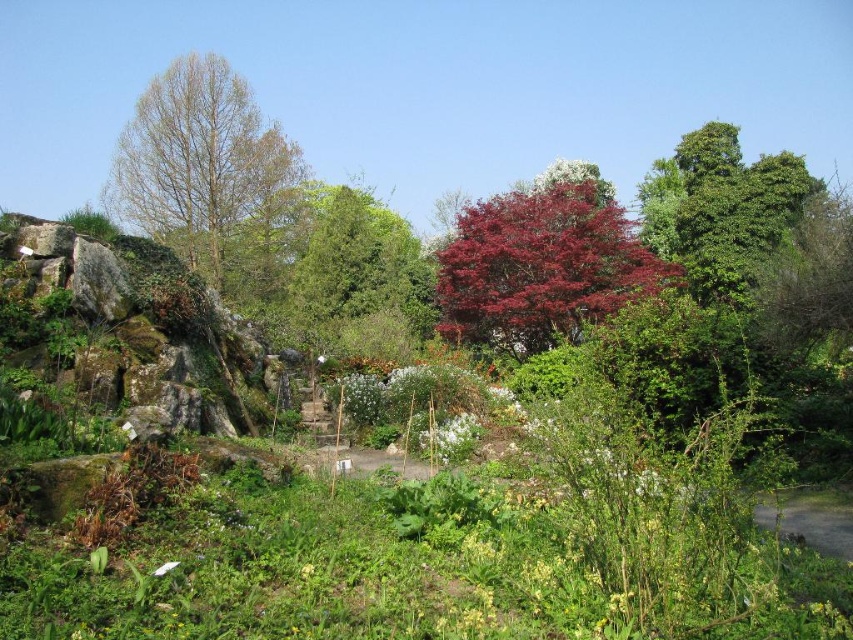
Based on the photo, you are a gardener who needs to water both the green mossy rock at left and the glossy red tree at center. The watering can you have can only hold enough water to reach 6 meters. Can you water both without refilling?

The green mossy rock at left is 6.57 meters away from glossy red tree at center. Since the distance between them is more than 6 meters, you cannot water both without refilling the watering can.

You are a bird looking for a nesting spot in the garden. You see the bare wood tree at left and the glossy red tree at center. Which tree is taller and would provide a better vantage point?

The bare wood tree at left is taller than the glossy red tree at center, so it would provide a better vantage point for nesting.